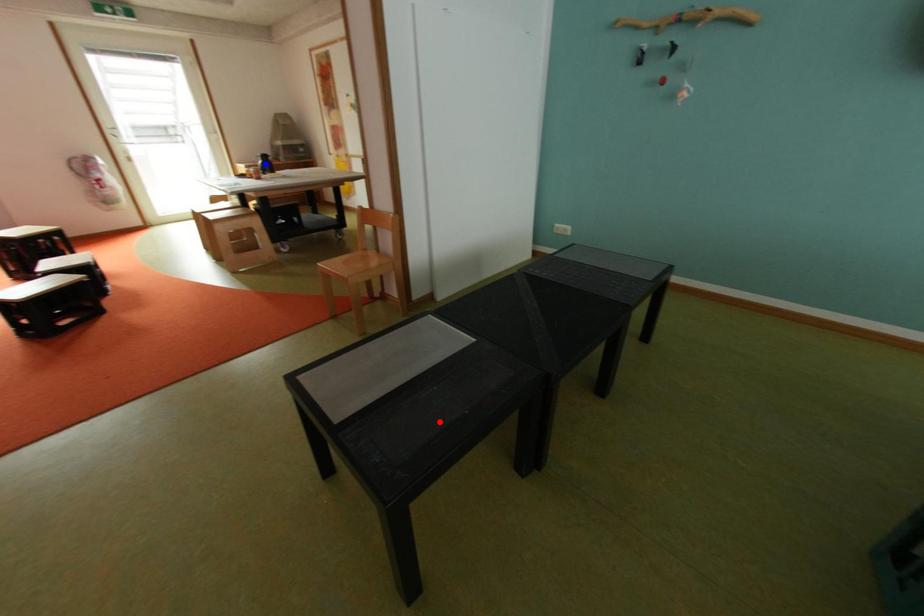
Question: In the image, two points are highlighted. Which point is nearer to the camera? Reply with the corresponding letter.

Choices:
 (A) blue point
 (B) red point

Answer: (B)